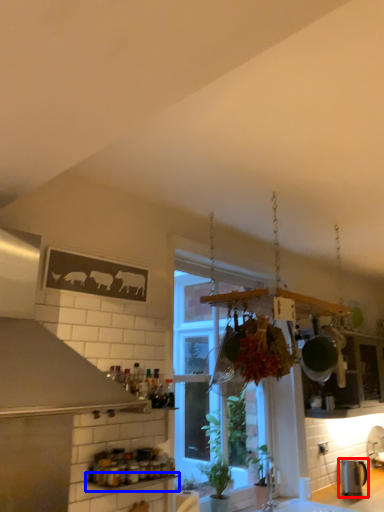
Question: Which object is closer to the camera taking this photo, kitchen appliance (highlighted by a red box) or window sill (highlighted by a blue box)?

Choices:
 (A) kitchen appliance
 (B) window sill

Answer: (B)